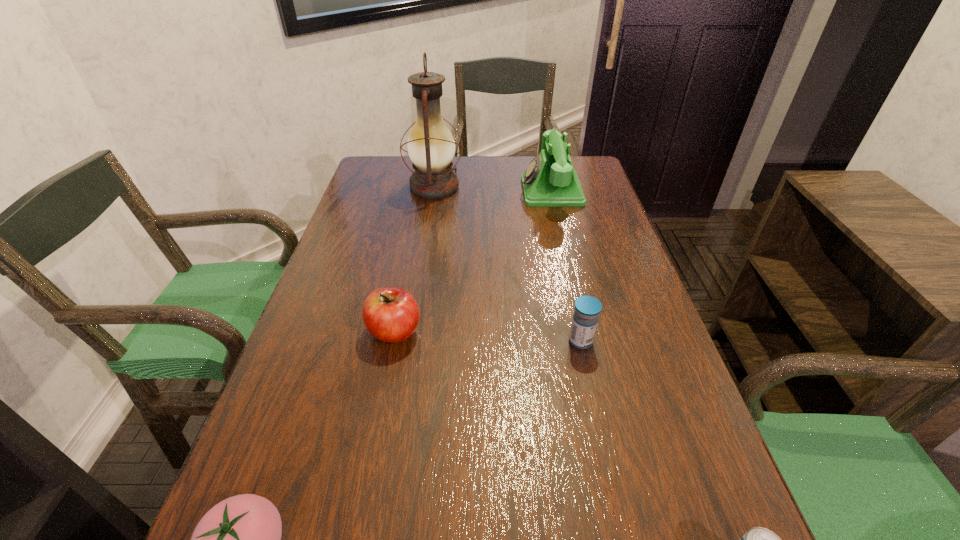
This screenshot has width=960, height=540. In order to click on oil lamp that is at the far edge in this screenshot , I will do `click(431, 147)`.

Locate an element on the screen. The width and height of the screenshot is (960, 540). telephone positioned at the far edge is located at coordinates (550, 180).

Locate an element on the screen. oil lamp situated at the left edge is located at coordinates (x=431, y=147).

Identify the location of apple located in the left edge section of the desktop. Image resolution: width=960 pixels, height=540 pixels. (391, 314).

The image size is (960, 540). I want to click on telephone at the right edge, so click(550, 180).

This screenshot has width=960, height=540. I want to click on medicine positioned at the right edge, so coord(587,308).

Where is `object that is at the far left corner`? The image size is (960, 540). object that is at the far left corner is located at coordinates (431, 147).

This screenshot has height=540, width=960. What are the coordinates of `object at the far right corner` in the screenshot? It's located at (550, 180).

The image size is (960, 540). Identify the location of free space at the far edge of the desktop. (464, 191).

Identify the location of vacant space at the left edge of the desktop. This screenshot has width=960, height=540. (329, 441).